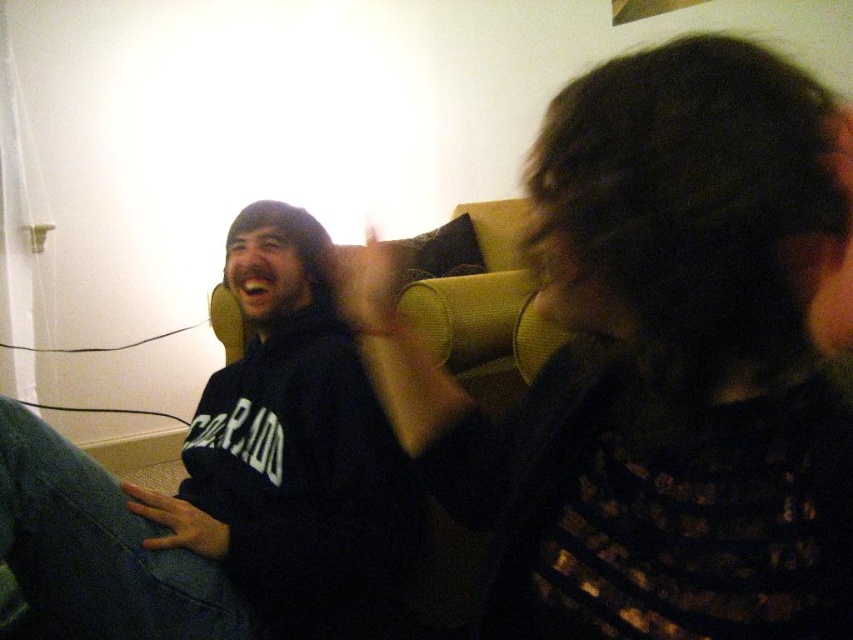
Is dark textured hair at upper right smaller than black matte sweatshirt at left?

Indeed, dark textured hair at upper right has a smaller size compared to black matte sweatshirt at left.

In the scene shown: Between dark textured hair at upper right and black matte sweatshirt at left, which one is positioned higher?

Positioned higher is dark textured hair at upper right.

Where is `dark textured hair at upper right`? The width and height of the screenshot is (853, 640). dark textured hair at upper right is located at coordinates (660, 362).